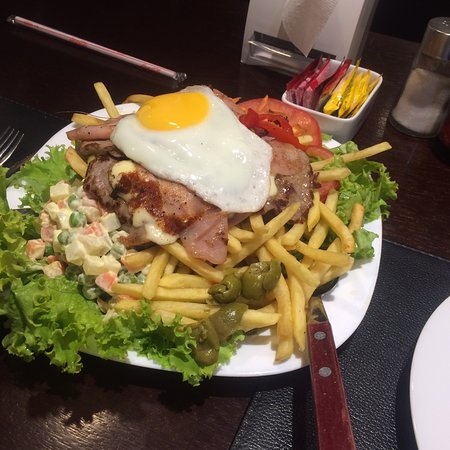
Where is `spoon`? This screenshot has width=450, height=450. spoon is located at coordinates (321, 315).